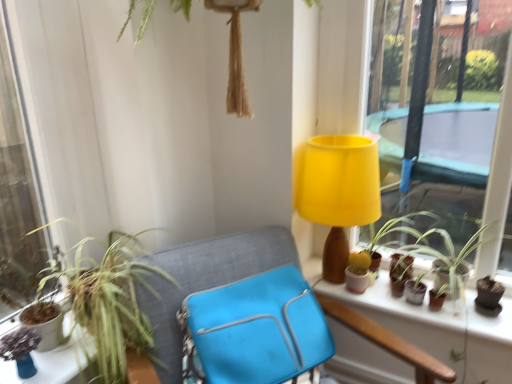
Question: Is green leafy plant at left, placed as the 1th houseplant when sorted from left to right, spatially inside matte brown flowerpot at right, which is the first flowerpot from right to left, or outside of it?

Choices:
 (A) outside
 (B) inside

Answer: (A)

Question: Looking at the image, does green leafy plant at left, placed as the 1th houseplant when sorted from left to right, seem bigger or smaller compared to matte brown flowerpot at right, the 2th flowerpot from the left?

Choices:
 (A) small
 (B) big

Answer: (B)

Question: Based on their relative distances, which object is farther from the matte white flowerpot at right, the 2th flowerpot when ordered from right to left?

Choices:
 (A) matte brown flowerpot at right, the 2th flowerpot from the left
 (B) matte brown window sill at upper right
 (C) yellow fabric lampshade at upper center
 (D) matte green plant at lower left
 (E) green leafy plant at left, which is the second houseplant from right to left

Answer: (D)

Question: Considering the real-world distances, which object is farthest from the green leafy plant at left, which is the second houseplant from right to left?

Choices:
 (A) matte white flowerpot at right, the 2th flowerpot when ordered from right to left
 (B) blue fabric folding chair at center
 (C) blue fabric bag at center
 (D) matte brown window sill at upper right
 (E) green matte plant at right, the 1th houseplant positioned from the right

Answer: (E)